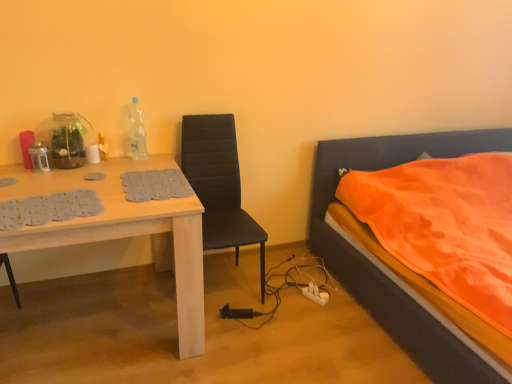
Where is `free spot below light wood table at left (from a real-world perspective)`? This screenshot has width=512, height=384. free spot below light wood table at left (from a real-world perspective) is located at coordinates (91, 324).